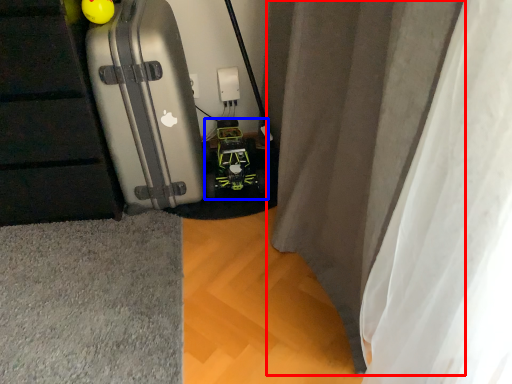
Question: Among these objects, which one is nearest to the camera, curtain (highlighted by a red box) or toy car (highlighted by a blue box)?

Choices:
 (A) curtain
 (B) toy car

Answer: (A)